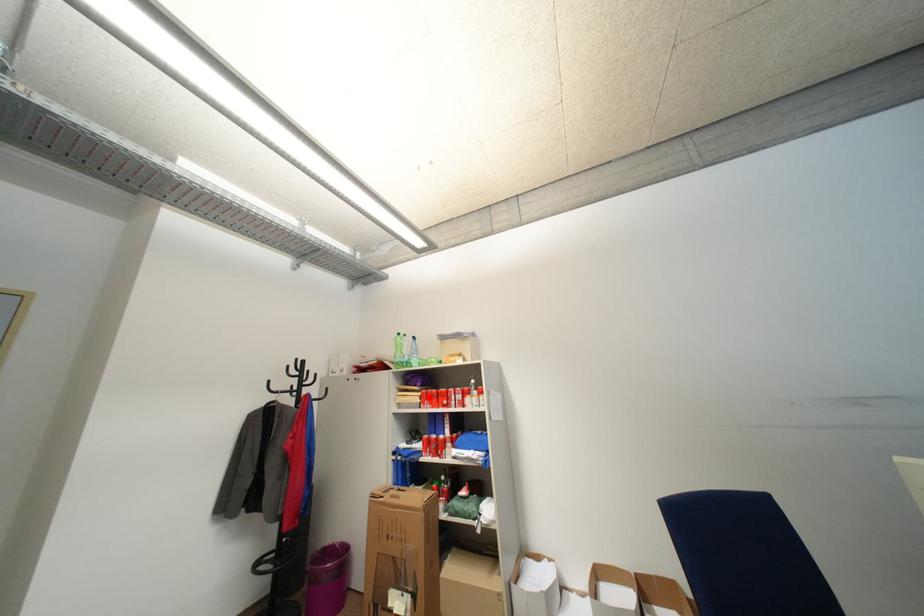
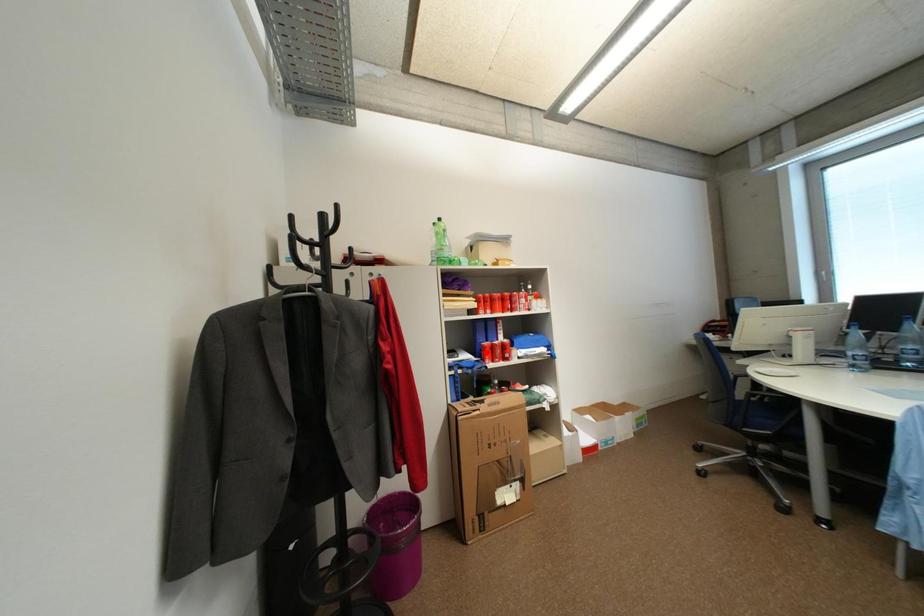
Consider the image. I am providing you with two images of the same scene from different viewpoints. A red point is marked on the first image and another point is marked on the second image. Are the points marked in image1 and image2 representing the same 3D position?

No